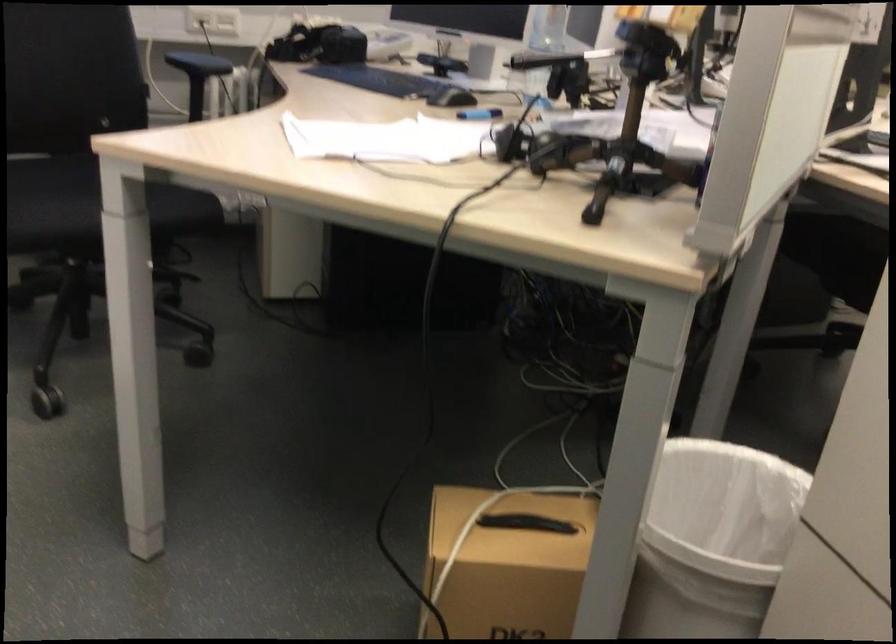
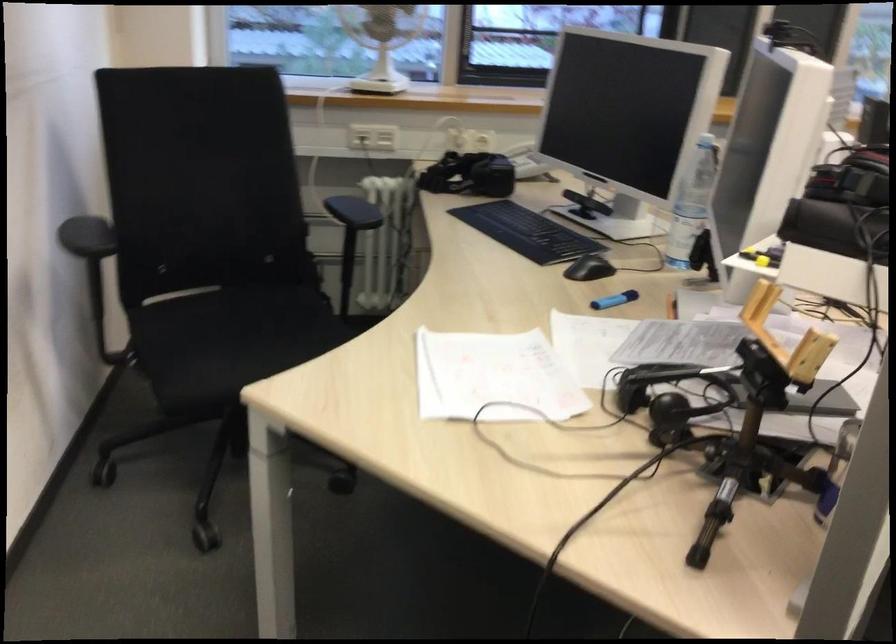
Question: How did the camera likely rotate?

Choices:
 (A) Left
 (B) Right
 (C) Up
 (D) Down

Answer: (A)